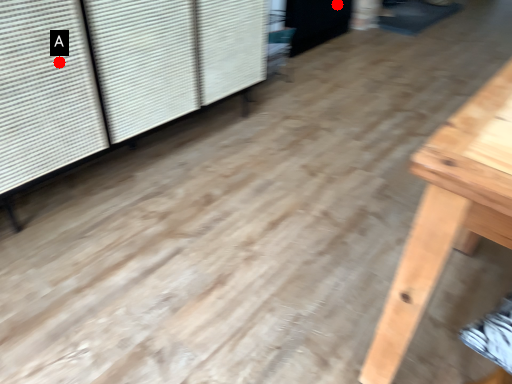
Question: Two points are circled on the image, labeled by A and B beside each circle. Which point is closer to the camera?

Choices:
 (A) A is closer
 (B) B is closer

Answer: (A)